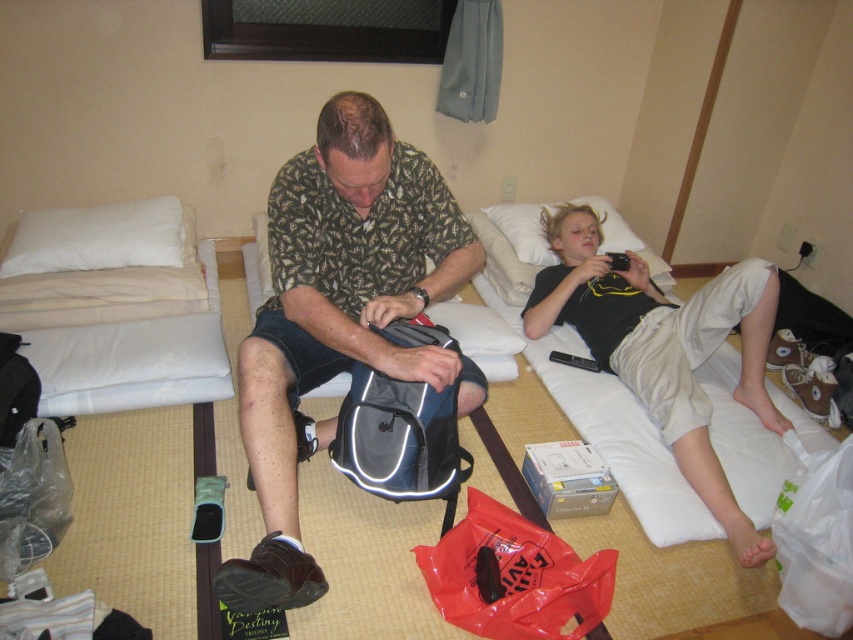
Which is more to the right, matte black backpack at center or gray fabric backpack at center?

gray fabric backpack at center

Does matte black backpack at center have a smaller size compared to gray fabric backpack at center?

Actually, matte black backpack at center might be larger than gray fabric backpack at center.

Between point (381, 115) and point (456, 500), which one is positioned in front?

Point (381, 115)

At what (x,y) coordinates should I click in order to perform the action: click on matte black backpack at center. Please return your answer as a coordinate pair (x, y). This screenshot has height=640, width=853. Looking at the image, I should click on (338, 316).

In the scene shown: Between gray fabric backpack at center and white plastic bag at lower right, which one has more height?

gray fabric backpack at center is taller.

Who is lower down, gray fabric backpack at center or white plastic bag at lower right?

white plastic bag at lower right

This screenshot has height=640, width=853. Describe the element at coordinates (399, 440) in the screenshot. I see `gray fabric backpack at center` at that location.

This screenshot has width=853, height=640. Find the location of `gray fabric backpack at center`. gray fabric backpack at center is located at coordinates click(x=399, y=440).

Describe the element at coordinates (816, 538) in the screenshot. This screenshot has height=640, width=853. I see `white plastic bag at lower right` at that location.

Is point (779, 552) more distant than point (137, 253)?

No, (779, 552) is closer to viewer.

Find the location of a particular element. white plastic bag at lower right is located at coordinates (816, 538).

Locate an element on the screen. white plastic bag at lower right is located at coordinates (816, 538).